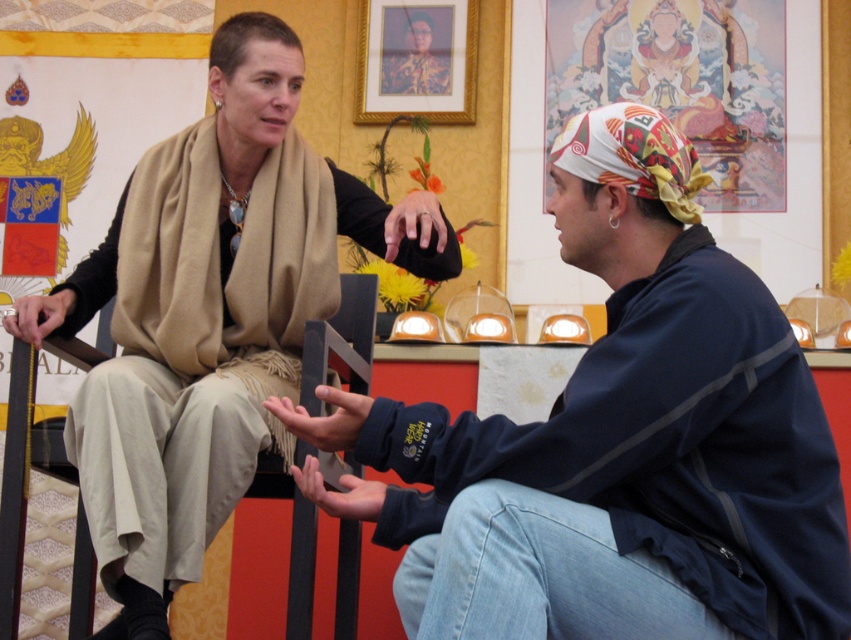
You are a photographer standing at the camera position. You want to focus on the person closer to you. Which point should you focus on, point (528, 554) or point (14, 378)?

Point (528, 554) is closer to the camera than point (14, 378), so you should focus on point (528, 554) to capture the person closer to you.